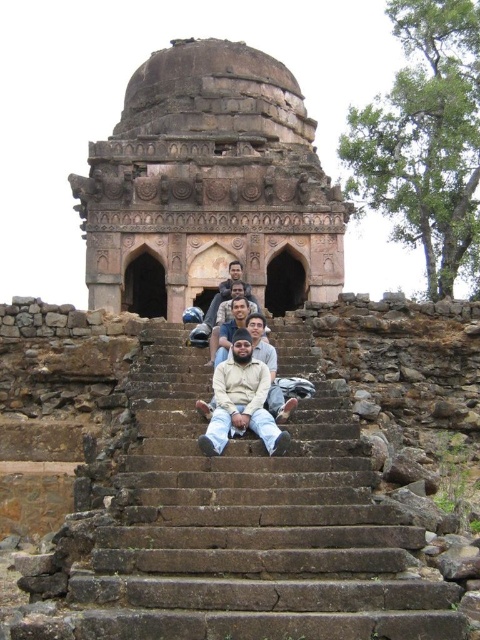
Is brown stone stairs at center taller than beige cotton shirt at center?

Yes, brown stone stairs at center is taller than beige cotton shirt at center.

Is point (157, 460) positioned before point (225, 417)?

Yes.

Where is `brown stone stairs at center`? This screenshot has height=640, width=480. brown stone stairs at center is located at coordinates (235, 529).

Who is more distant from viewer, (304, 560) or (228, 195)?

The point (228, 195) is behind.

Where is `brown stone stairs at center`? The width and height of the screenshot is (480, 640). brown stone stairs at center is located at coordinates (235, 529).

Is point (347, 500) more distant than point (291, 138)?

That is False.

Identify the location of brown stone stairs at center. (235, 529).

Does rustic stone dome at center have a greater height compared to beige cotton shirt at center?

Yes, rustic stone dome at center is taller than beige cotton shirt at center.

Is rustic stone dome at center closer to the viewer compared to beige cotton shirt at center?

No, rustic stone dome at center is further to the viewer.

Does point (180, 244) lie behind point (277, 451)?

That is True.

The image size is (480, 640). Find the location of `rustic stone dome at center`. rustic stone dome at center is located at coordinates (208, 186).